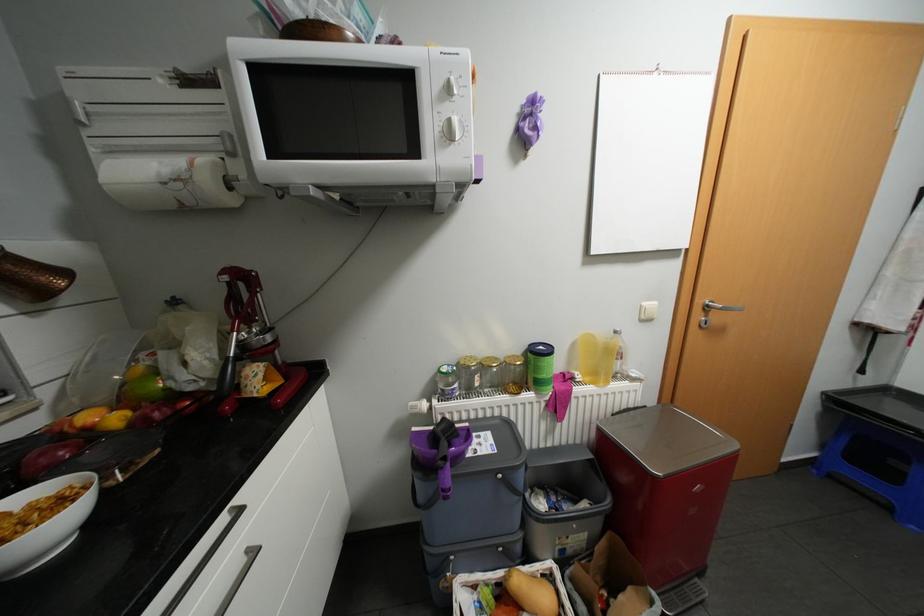
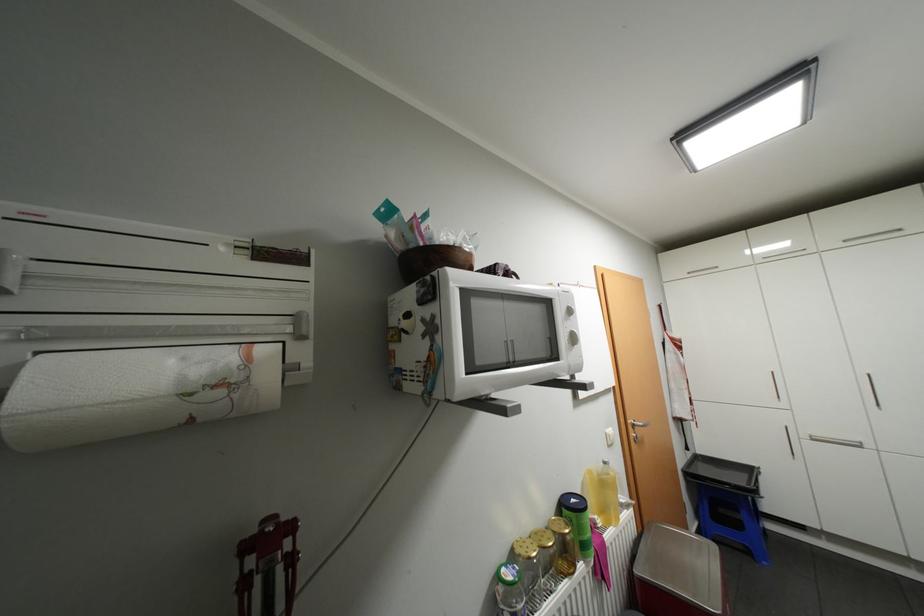
In the second image, find the point that corresponds to [587,377] in the first image.

(606, 521)